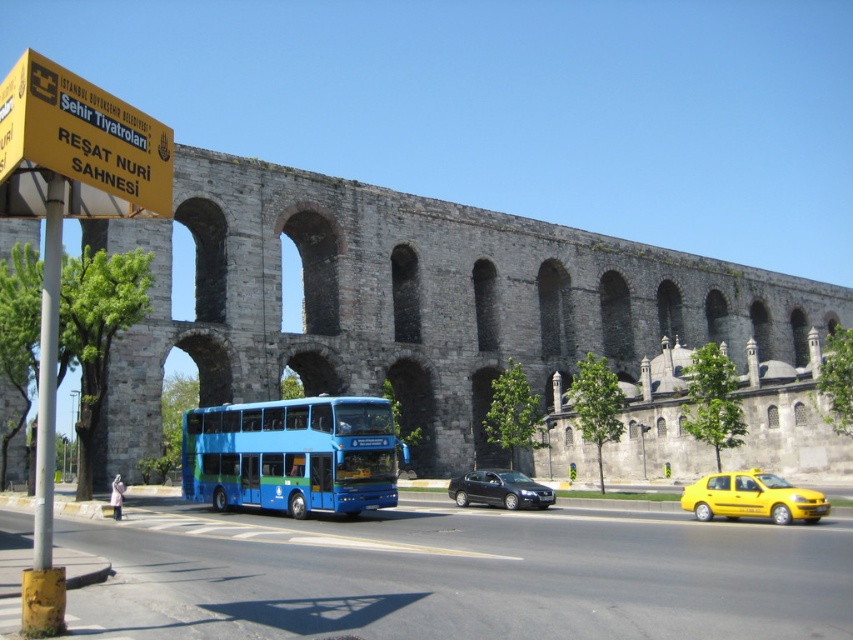
Consider the image. You are a pedestrian standing at the intersection near the yellow plastic sign at upper left and the yellow matte taxi at lower right. Which object is closer to your right side?

The yellow matte taxi at lower right is to the right of the yellow plastic sign at upper left, so the yellow matte taxi at lower right is closer to your right side.

You are a pedestrian standing at the side of the road and see the blue metallic bus at center and the shiny black sedan at center. Which vehicle is closer to the historical stone structure?

The blue metallic bus at center is positioned on the left side of the shiny black sedan at center. Since the historical stone structure is on the right side of the road, the shiny black sedan at center is closer to it.